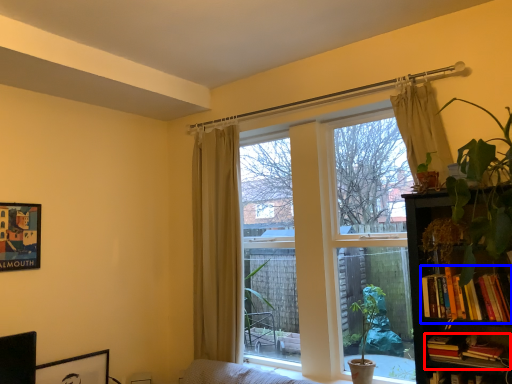
Question: Which of the following is the closest to the observer, book (highlighted by a red box) or book (highlighted by a blue box)?

Choices:
 (A) book
 (B) book

Answer: (B)